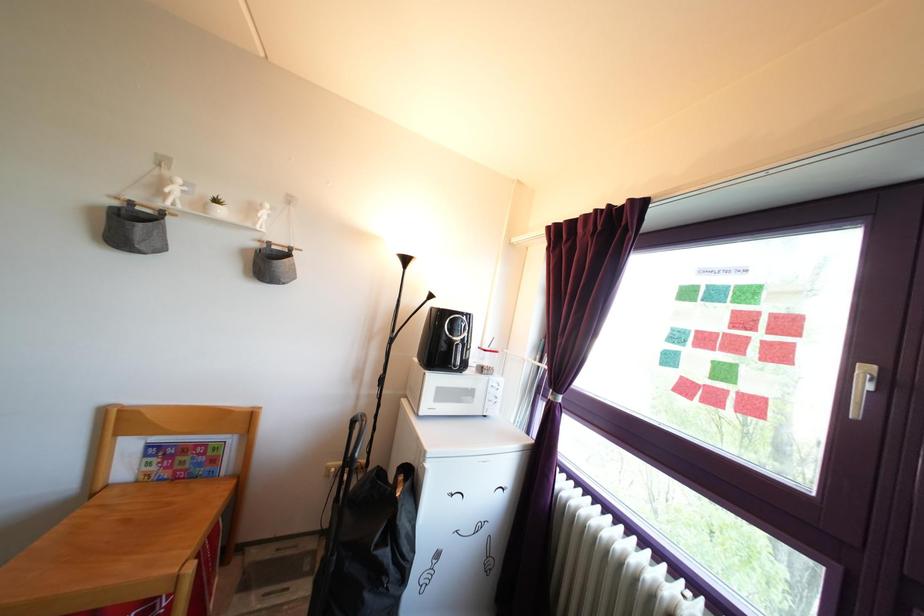
The image size is (924, 616). Describe the element at coordinates (116, 549) in the screenshot. I see `the chair sitting surface` at that location.